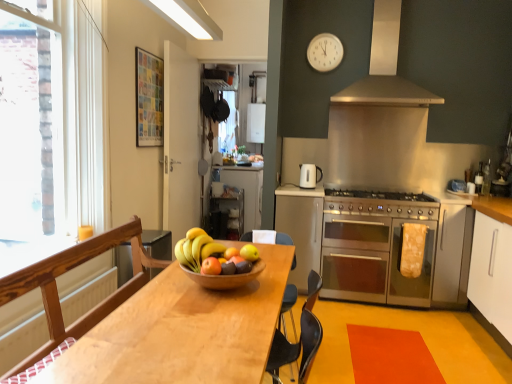
The image size is (512, 384). I want to click on free location above white plastic clock at upper center (from a real-world perspective), so click(327, 27).